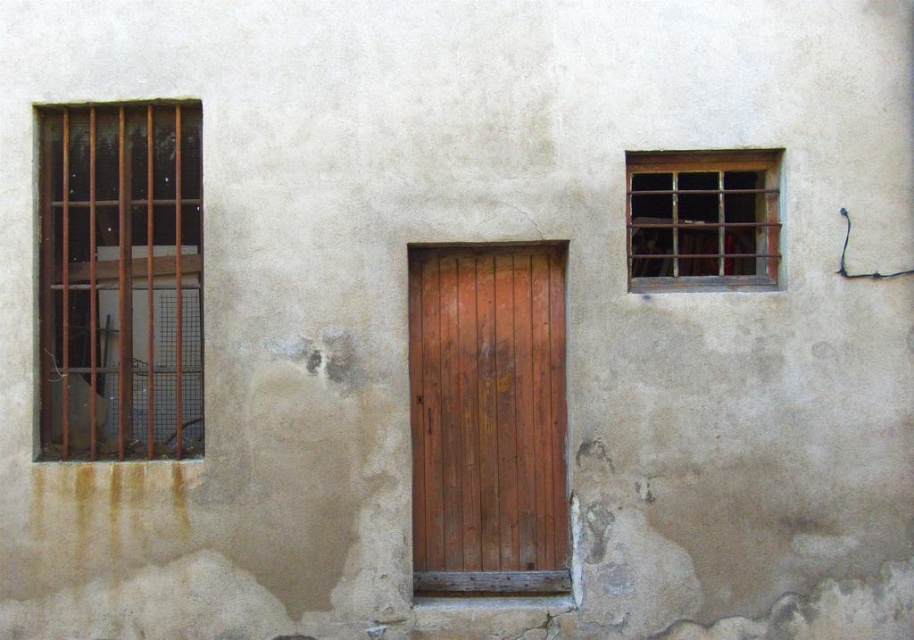
Is brown wooden bars at left closer to camera compared to rusty metal bars at upper right?

No, it is not.

Is brown wooden bars at left bigger than rusty metal bars at upper right?

Yes.

Identify the location of brown wooden bars at left. (120, 280).

Is brown wooden bars at left taller than weathered wood door at center?

Correct, brown wooden bars at left is much taller as weathered wood door at center.

Is point (133, 122) positioned before point (558, 348)?

No, it is not.

Locate an element on the screen. brown wooden bars at left is located at coordinates (120, 280).

Who is more forward, (561, 458) or (625, 216)?

Positioned in front is point (625, 216).

In order to click on weathered wood door at center in this screenshot , I will do `click(487, 419)`.